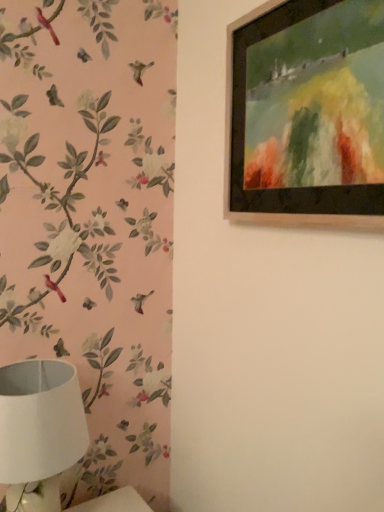
Question: Does wooden picture frame at upper right appear on the right side of white matte lampshade at lower left?

Choices:
 (A) yes
 (B) no

Answer: (A)

Question: Is wooden picture frame at upper right in front of white matte lampshade at lower left?

Choices:
 (A) no
 (B) yes

Answer: (B)

Question: Does wooden picture frame at upper right have a larger size compared to white matte lampshade at lower left?

Choices:
 (A) yes
 (B) no

Answer: (B)

Question: Is wooden picture frame at upper right to the left of white matte lampshade at lower left from the viewer's perspective?

Choices:
 (A) no
 (B) yes

Answer: (A)

Question: From the image's perspective, does wooden picture frame at upper right appear higher than white matte lampshade at lower left?

Choices:
 (A) yes
 (B) no

Answer: (A)

Question: Is wooden picture frame at upper right positioned with its back to white matte lampshade at lower left?

Choices:
 (A) yes
 (B) no

Answer: (B)

Question: From a real-world perspective, is white matte lampshade at lower left below wooden picture frame at upper right?

Choices:
 (A) yes
 (B) no

Answer: (A)

Question: Does white matte lampshade at lower left have a greater height compared to wooden picture frame at upper right?

Choices:
 (A) yes
 (B) no

Answer: (B)

Question: From the image's perspective, is white matte lampshade at lower left under wooden picture frame at upper right?

Choices:
 (A) no
 (B) yes

Answer: (B)

Question: Is wooden picture frame at upper right surrounded by white matte lampshade at lower left?

Choices:
 (A) no
 (B) yes

Answer: (A)

Question: Is white matte lampshade at lower left completely or partially outside of wooden picture frame at upper right?

Choices:
 (A) no
 (B) yes

Answer: (B)

Question: Considering the relative positions of white matte lampshade at lower left and wooden picture frame at upper right in the image provided, is white matte lampshade at lower left to the right of wooden picture frame at upper right from the viewer's perspective?

Choices:
 (A) no
 (B) yes

Answer: (A)

Question: In the image, is wooden picture frame at upper right positioned in front of or behind white matte lampshade at lower left?

Choices:
 (A) front
 (B) behind

Answer: (A)